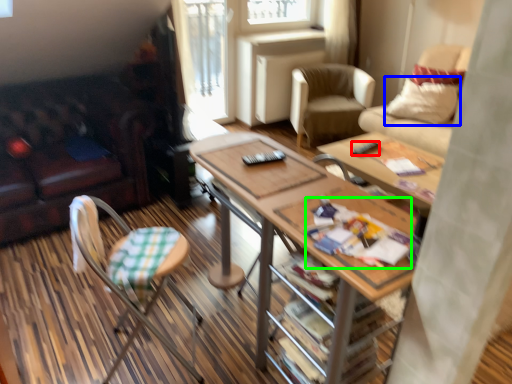
Question: Estimate the real-world distances between objects in this image. Which object is farther from remote control (highlighted by a red box), pillow (highlighted by a blue box) or magazine (highlighted by a green box)?

Choices:
 (A) pillow
 (B) magazine

Answer: (B)